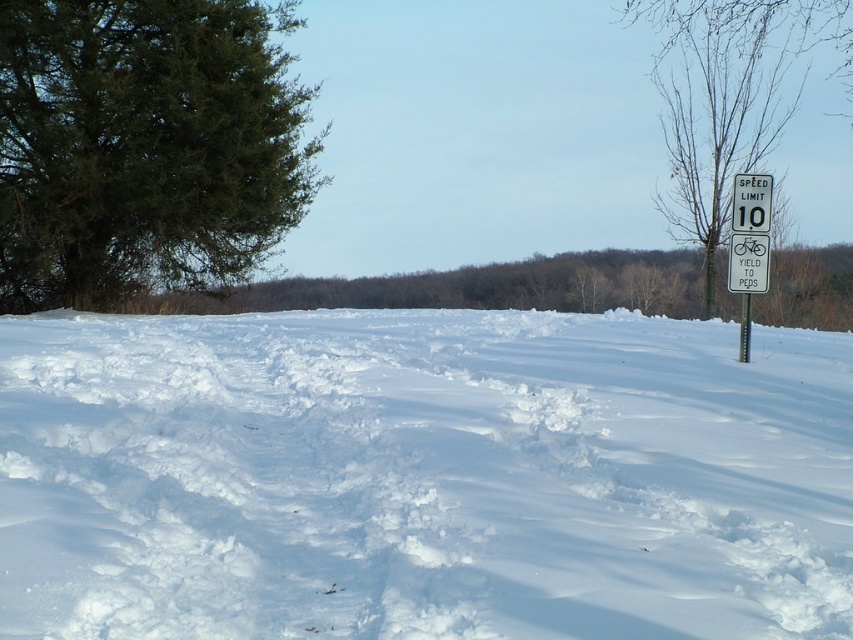
Is white fluffy snow at center to the right of bare wood tree at right from the viewer's perspective?

No, white fluffy snow at center is not to the right of bare wood tree at right.

At what (x,y) coordinates should I click in order to perform the action: click on white fluffy snow at center. Please return your answer as a coordinate pair (x, y). Looking at the image, I should click on (421, 477).

This screenshot has height=640, width=853. In order to click on white fluffy snow at center in this screenshot , I will do `click(421, 477)`.

Is bare wood tree at right in front of metallic silver pole at right?

No, it is behind metallic silver pole at right.

Which is more to the right, bare wood tree at right or metallic silver pole at right?

From the viewer's perspective, bare wood tree at right appears more on the right side.

Between point (787, 10) and point (743, 317), which one is positioned in front?

Point (743, 317) is in front.

Locate an element on the screen. The image size is (853, 640). bare wood tree at right is located at coordinates (753, 19).

Does green textured evergreen tree at left have a greater height compared to bare wood tree at right?

Correct, green textured evergreen tree at left is much taller as bare wood tree at right.

Measure the distance between green textured evergreen tree at left and bare wood tree at right.

green textured evergreen tree at left and bare wood tree at right are 15.47 meters apart.

In order to click on green textured evergreen tree at left in this screenshot , I will do `click(144, 145)`.